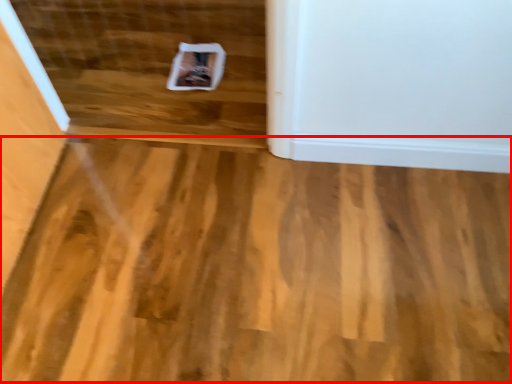
Question: From the image's perspective, where is plywood (annotated by the red box) located relative to stairwell?

Choices:
 (A) below
 (B) above

Answer: (A)